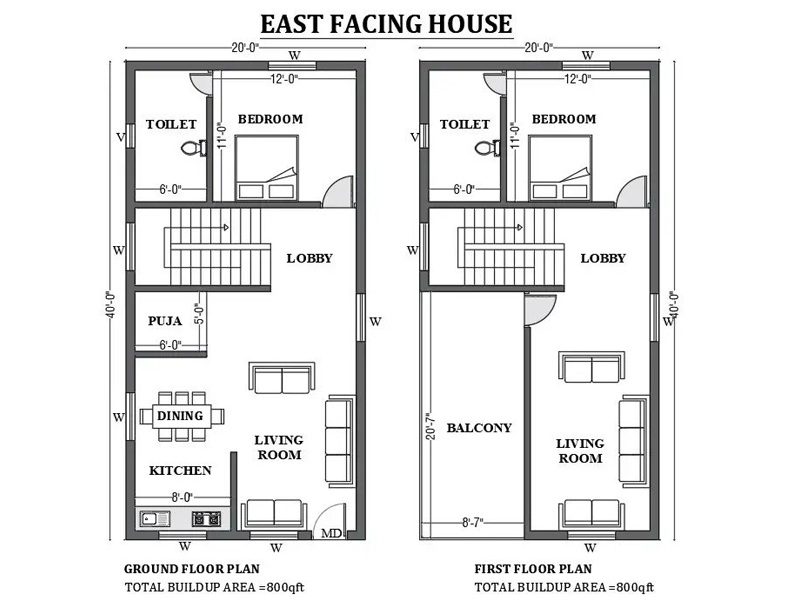
Find the location of a particular element. This screenshot has width=800, height=600. chairs is located at coordinates (161, 397), (184, 398), (196, 399), (218, 417), (198, 435), (181, 435), (164, 432), (146, 414).